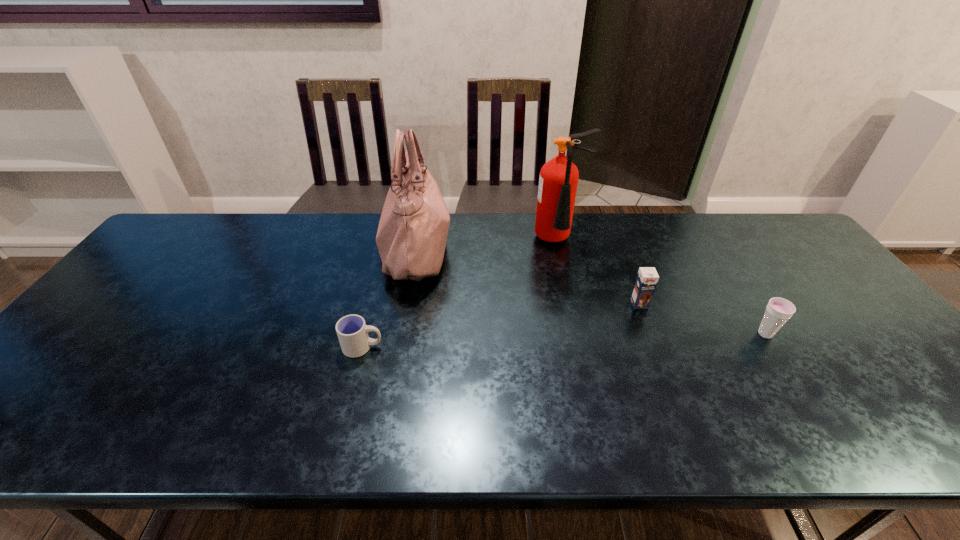
Identify the location of free space between the chocolate milk and the rightmost object. (703, 319).

This screenshot has width=960, height=540. Identify the location of vacant space that is in between the handbag and the fire extinguisher. (487, 245).

Where is `free space between the third object from right to left and the third shortest object`? free space between the third object from right to left and the third shortest object is located at coordinates (599, 273).

This screenshot has height=540, width=960. What are the coordinates of `vacant space that's between the right cup and the shortest object` in the screenshot? It's located at (564, 341).

Where is `vacant region between the handbag and the fourth object from left to right`? vacant region between the handbag and the fourth object from left to right is located at coordinates (527, 276).

I want to click on free space between the handbag and the right cup, so click(590, 292).

The height and width of the screenshot is (540, 960). I want to click on free space between the handbag and the shorter cup, so click(389, 298).

You are a GUI agent. You are given a task and a screenshot of the screen. Output one action in this format:
    pyautogui.click(x=<x>, y=<y>)
    Task: Click on the empty location between the second object from right to left and the third object from right to left
    The image size is (960, 540).
    Given the screenshot: What is the action you would take?
    pyautogui.click(x=599, y=273)

Find the location of a particular element. This screenshot has width=960, height=540. vacant area that lies between the third object from left to right and the second shortest object is located at coordinates (662, 288).

You are a GUI agent. You are given a task and a screenshot of the screen. Output one action in this format:
    pyautogui.click(x=<x>, y=<y>)
    Task: Click on the free space between the rightmost object and the fire extinguisher
    This screenshot has width=960, height=540.
    Given the screenshot: What is the action you would take?
    pyautogui.click(x=662, y=288)